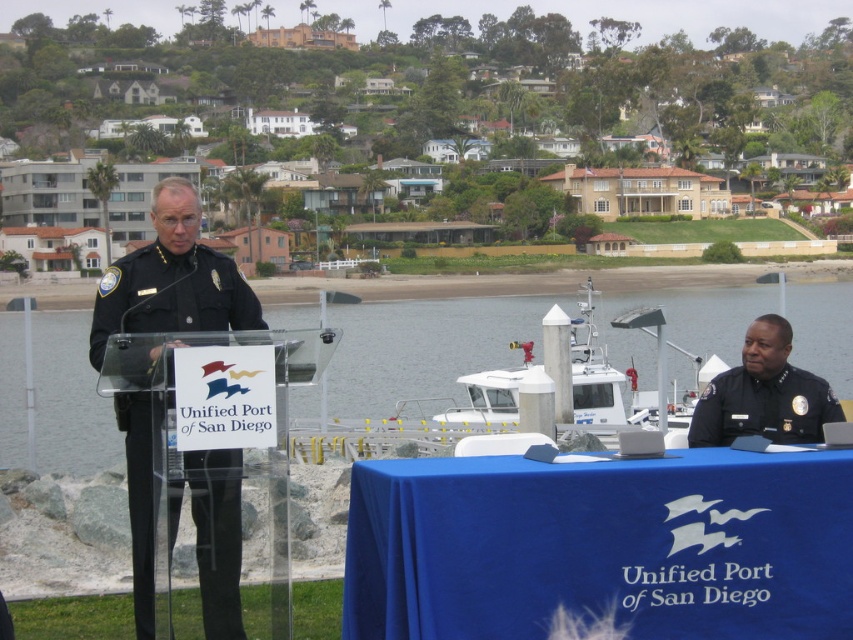
Is blue fabric table at lower right wider than white plastic boat at center?

Incorrect, blue fabric table at lower right's width does not surpass white plastic boat at center's.

Does blue fabric table at lower right lie in front of white plastic boat at center?

Yes, it is in front of white plastic boat at center.

Where is `blue fabric table at lower right`? The height and width of the screenshot is (640, 853). blue fabric table at lower right is located at coordinates (601, 547).

Which of these two, white plastic boat at center or black uniform at right, stands taller?

white plastic boat at center

Does white plastic boat at center appear over black uniform at right?

Yes, white plastic boat at center is above black uniform at right.

What are the coordinates of `white plastic boat at center` in the screenshot? It's located at pos(622,374).

Where is `white plastic boat at center`? white plastic boat at center is located at coordinates (622, 374).

Which is behind, point (398, 499) or point (699, 416)?

The point (699, 416) is more distant.

Which of these two, blue fabric table at lower right or black uniform at right, stands taller?

black uniform at right

Which is in front, point (758, 560) or point (752, 358)?

Point (758, 560)

In order to click on blue fabric table at lower right in this screenshot , I will do [601, 547].